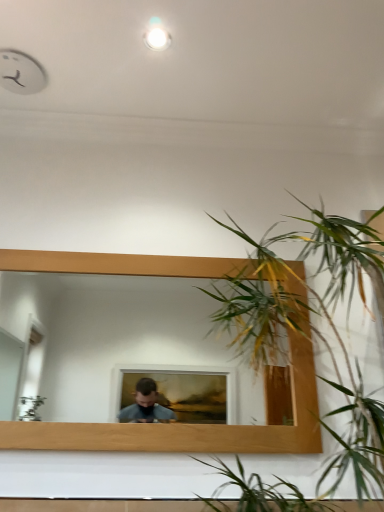
Describe the element at coordinates (157, 38) in the screenshot. I see `white glossy light at upper center` at that location.

The image size is (384, 512). Describe the element at coordinates (123, 349) in the screenshot. I see `wooden mirror at center` at that location.

Where is `white glossy light at upper center`? This screenshot has width=384, height=512. white glossy light at upper center is located at coordinates (157, 38).

In the scene shown: Is white glossy light at upper center touching wooden mirror at center?

They are not placed beside each other.

Which object is wider, white glossy light at upper center or wooden mirror at center?

With larger width is white glossy light at upper center.

Is white glossy light at upper center completely or partially outside of wooden mirror at center?

Yes, white glossy light at upper center is not within wooden mirror at center.

Considering the relative sizes of green leafy plant at right and wooden mirror at center in the image provided, is green leafy plant at right wider than wooden mirror at center?

Yes, green leafy plant at right is wider than wooden mirror at center.

Is green leafy plant at right further to the viewer compared to wooden mirror at center?

No, the depth of green leafy plant at right is less than that of wooden mirror at center.

Is green leafy plant at right oriented towards wooden mirror at center?

No, green leafy plant at right is not aimed at wooden mirror at center.

Which of these two, green leafy plant at right or wooden mirror at center, stands shorter?

Standing shorter between the two is wooden mirror at center.

Which of these two, wooden mirror at center or green leafy plant at right, is thinner?

wooden mirror at center is thinner.

Is wooden mirror at center at the left side of green leafy plant at right?

Yes.

Are wooden mirror at center and green leafy plant at right making contact?

wooden mirror at center is not next to green leafy plant at right, and they're not touching.

You are a GUI agent. You are given a task and a screenshot of the screen. Output one action in this format:
    pyautogui.click(x=<x>, y=<y>)
    Task: Click on the houseplant that appears above the wooden mirror at center (from the image's perspective)
    Image resolution: width=384 pixels, height=512 pixels.
    Given the screenshot: What is the action you would take?
    click(x=312, y=326)

In the image, is white glossy light at upper center positioned in front of or behind green leafy plant at right?

white glossy light at upper center is positioned farther from the viewer than green leafy plant at right.

In terms of width, does white glossy light at upper center look wider or thinner when compared to green leafy plant at right?

Considering their sizes, white glossy light at upper center looks slimmer than green leafy plant at right.

Does white glossy light at upper center have a larger size compared to green leafy plant at right?

No, white glossy light at upper center is not bigger than green leafy plant at right.

Consider the image. Is white glossy light at upper center not inside green leafy plant at right?

Yes, white glossy light at upper center is not within green leafy plant at right.

Looking at this image, from the image's perspective, which one is positioned higher, wooden mirror at center or white glossy light at upper center?

white glossy light at upper center, from the image's perspective.

Is wooden mirror at center directly adjacent to white glossy light at upper center?

wooden mirror at center and white glossy light at upper center are clearly separated.

Is wooden mirror at center further to camera compared to white glossy light at upper center?

No, it is in front of white glossy light at upper center.

Does wooden mirror at center contain white glossy light at upper center?

No, white glossy light at upper center is not inside wooden mirror at center.

Is point (300, 322) farther from viewer compared to point (147, 42)?

That is True.

This screenshot has width=384, height=512. I want to click on houseplant on the right of white glossy light at upper center, so click(312, 326).

Is green leafy plant at right in contact with white glossy light at upper center?

There is a gap between green leafy plant at right and white glossy light at upper center.

Considering the relative sizes of green leafy plant at right and white glossy light at upper center in the image provided, is green leafy plant at right wider than white glossy light at upper center?

Yes.

Where is `light above the wooden mirror at center (from a real-world perspective)`? Image resolution: width=384 pixels, height=512 pixels. light above the wooden mirror at center (from a real-world perspective) is located at coordinates (157, 38).

Locate an element on the screen. This screenshot has width=384, height=512. mirror beneath the green leafy plant at right (from a real-world perspective) is located at coordinates (123, 349).

Looking at the image, which one is located further to green leafy plant at right, white glossy light at upper center or wooden mirror at center?

wooden mirror at center lies further to green leafy plant at right than the other object.

Estimate the real-world distances between objects in this image. Which object is closer to white glossy light at upper center, wooden mirror at center or green leafy plant at right?

Based on the image, green leafy plant at right appears to be nearer to white glossy light at upper center.

Based on their spatial positions, is green leafy plant at right or wooden mirror at center further from white glossy light at upper center?

Based on the image, wooden mirror at center appears to be further to white glossy light at upper center.

Looking at the image, which one is located closer to wooden mirror at center, green leafy plant at right or white glossy light at upper center?

Among the two, green leafy plant at right is located nearer to wooden mirror at center.

When comparing their distances from wooden mirror at center, does white glossy light at upper center or green leafy plant at right seem closer?

green leafy plant at right is closer to wooden mirror at center.

Looking at this image, based on their spatial positions, is wooden mirror at center or white glossy light at upper center further from green leafy plant at right?

wooden mirror at center lies further to green leafy plant at right than the other object.

Locate an element on the screen. This screenshot has width=384, height=512. houseplant that lies between white glossy light at upper center and wooden mirror at center from top to bottom is located at coordinates (312, 326).